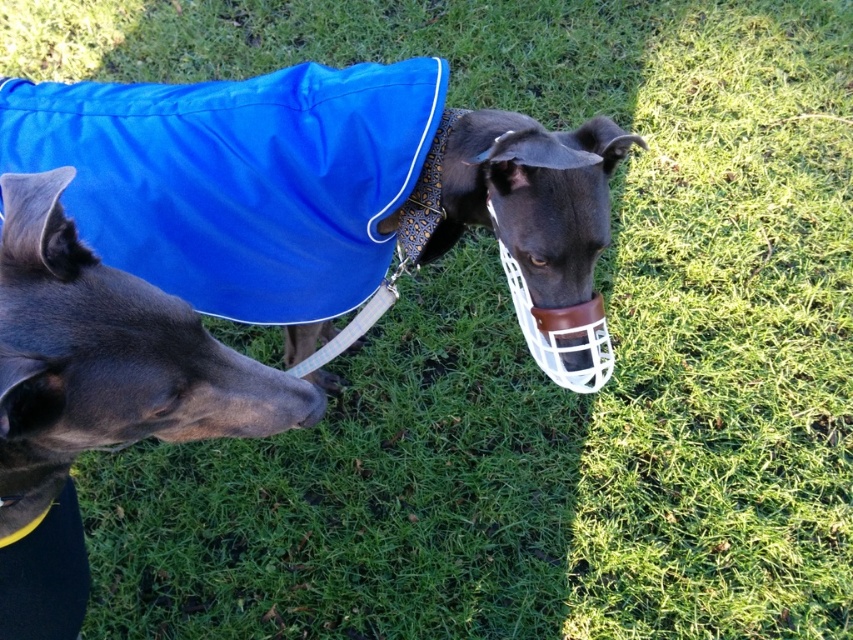
Question: Which point appears closest to the camera in this image?

Choices:
 (A) (160, 196)
 (B) (117, 419)

Answer: (B)

Question: Does shiny blue coat at center have a greater width compared to shiny black coat at center?

Choices:
 (A) yes
 (B) no

Answer: (A)

Question: Among these objects, which one is nearest to the camera?

Choices:
 (A) shiny black coat at center
 (B) shiny blue coat at center

Answer: (A)

Question: Is shiny blue coat at center in front of shiny black coat at center?

Choices:
 (A) yes
 (B) no

Answer: (B)

Question: Is shiny blue coat at center above shiny black coat at center?

Choices:
 (A) yes
 (B) no

Answer: (A)